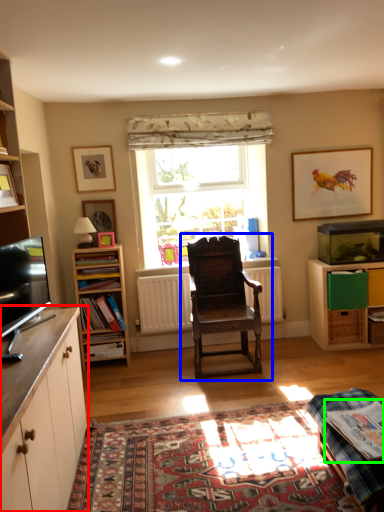
Question: Which object is the farthest from cabinetry (highlighted by a red box)? Choose among these: chair (highlighted by a blue box) or book (highlighted by a green box).

Choices:
 (A) chair
 (B) book

Answer: (A)